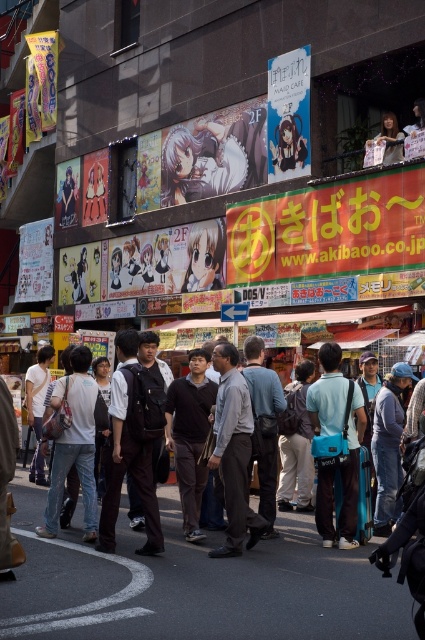
Question: Considering the relative positions of dark gray suit at center and teal fabric backpack at center in the image provided, where is dark gray suit at center located with respect to teal fabric backpack at center?

Choices:
 (A) left
 (B) right

Answer: (A)

Question: Considering the relative positions of dark gray fabric shirt at center and white cotton shirt at center in the image provided, where is dark gray fabric shirt at center located with respect to white cotton shirt at center?

Choices:
 (A) left
 (B) right

Answer: (B)

Question: Based on their relative distances, which object is farther from the dark gray suit at center?

Choices:
 (A) dark gray fabric shirt at center
 (B) teal fabric backpack at center

Answer: (B)

Question: Does dark gray suit at center have a lesser width compared to teal fabric backpack at center?

Choices:
 (A) no
 (B) yes

Answer: (A)

Question: Which point is farther to the camera?

Choices:
 (A) dark gray suit at center
 (B) white cotton shirt at center
 (C) dark gray fabric shirt at center

Answer: (B)

Question: Based on their relative distances, which object is farther from the white cotton shirt at center?

Choices:
 (A) teal fabric backpack at center
 (B) dark gray fabric shirt at center
 (C) dark gray suit at center

Answer: (A)